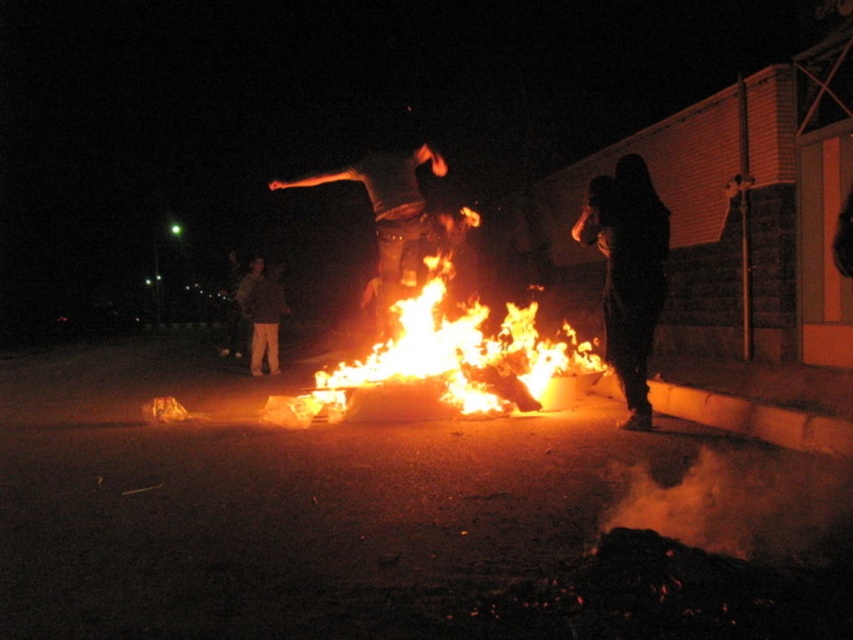
Question: Is flaming wood at center below dark brown fabric pants at lower left?

Choices:
 (A) no
 (B) yes

Answer: (A)

Question: Which of the following is the farthest from the observer?

Choices:
 (A) (308, 394)
 (B) (651, 276)
 (C) (404, 259)

Answer: (C)

Question: Is dark gray jeans at center in front of dark brown fabric pants at lower left?

Choices:
 (A) yes
 (B) no

Answer: (A)

Question: Is dark gray jeans at center in front of dark brown fabric pants at lower left?

Choices:
 (A) no
 (B) yes

Answer: (B)

Question: Which object appears closest to the camera in this image?

Choices:
 (A) dark brown fabric pants at lower left
 (B) black matte figure at right

Answer: (B)

Question: Which point is closer to the camera taking this photo?

Choices:
 (A) (274, 337)
 (B) (654, 195)

Answer: (B)